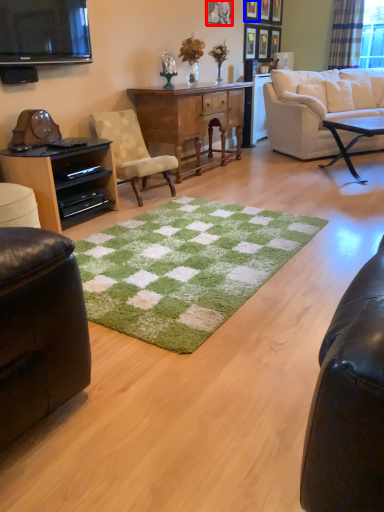
Question: Which point is further to the camera, picture frame (highlighted by a red box) or picture frame (highlighted by a blue box)?

Choices:
 (A) picture frame
 (B) picture frame

Answer: (B)